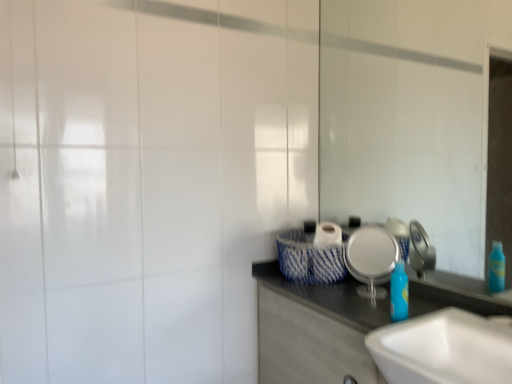
Question: Is white glossy mirror at upper right at the right side of silver metallic plate at center?

Choices:
 (A) no
 (B) yes

Answer: (B)

Question: Does white glossy mirror at upper right have a lesser height compared to silver metallic plate at center?

Choices:
 (A) no
 (B) yes

Answer: (A)

Question: Is white glossy mirror at upper right oriented away from silver metallic plate at center?

Choices:
 (A) yes
 (B) no

Answer: (B)

Question: Is white glossy mirror at upper right not inside silver metallic plate at center?

Choices:
 (A) no
 (B) yes

Answer: (B)

Question: Is white glossy mirror at upper right not near silver metallic plate at center?

Choices:
 (A) no
 (B) yes

Answer: (A)

Question: Can you confirm if white glossy mirror at upper right is wider than silver metallic plate at center?

Choices:
 (A) yes
 (B) no

Answer: (B)

Question: Is blue plastic bottle at center in contact with white glossy mirror at upper right?

Choices:
 (A) no
 (B) yes

Answer: (A)

Question: Is blue plastic bottle at center thinner than white glossy mirror at upper right?

Choices:
 (A) no
 (B) yes

Answer: (A)

Question: Is blue plastic bottle at center turned away from white glossy mirror at upper right?

Choices:
 (A) yes
 (B) no

Answer: (A)

Question: Is blue plastic bottle at center positioned behind white glossy mirror at upper right?

Choices:
 (A) no
 (B) yes

Answer: (B)

Question: Is blue plastic bottle at center at the left side of white glossy mirror at upper right?

Choices:
 (A) yes
 (B) no

Answer: (A)

Question: Does blue plastic bottle at center have a greater width compared to white glossy mirror at upper right?

Choices:
 (A) yes
 (B) no

Answer: (A)

Question: Is white glossy cabinet at lower right not near white glossy mirror at upper right?

Choices:
 (A) no
 (B) yes

Answer: (A)